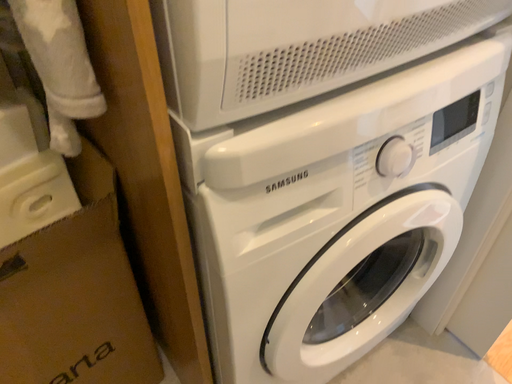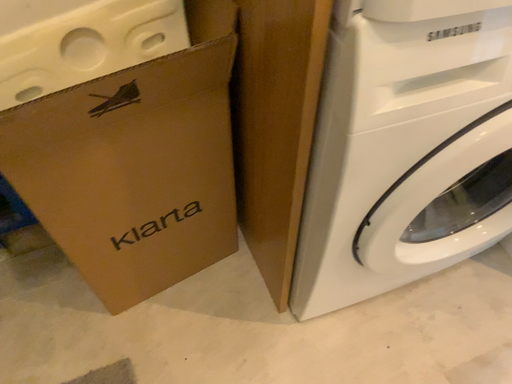
Question: Which way did the camera rotate in the video?

Choices:
 (A) rotated left
 (B) rotated right

Answer: (A)